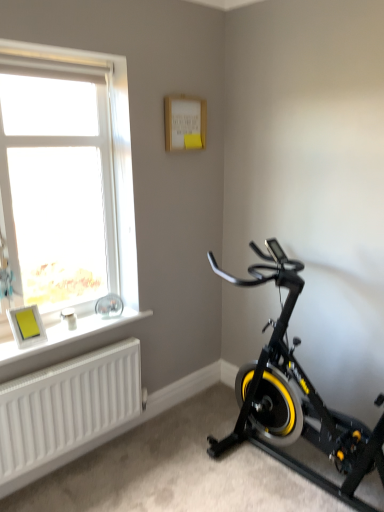
Question: From their relative heights in the image, would you say matte yellow picture frame at lower left is taller or shorter than black matte stationary bicycle at lower right?

Choices:
 (A) tall
 (B) short

Answer: (B)

Question: Is matte yellow picture frame at lower left in front of or behind black matte stationary bicycle at lower right in the image?

Choices:
 (A) behind
 (B) front

Answer: (A)

Question: Estimate the real-world distances between objects in this image. Which object is closer to the white plastic window at upper left?

Choices:
 (A) matte yellow picture frame at lower left
 (B) black matte stationary bicycle at lower right
 (C) white matte radiator at lower left
 (D) white matte window sill at lower left

Answer: (A)

Question: Which object is positioned closest to the black matte stationary bicycle at lower right?

Choices:
 (A) white plastic window at upper left
 (B) matte yellow picture frame at lower left
 (C) white matte window sill at lower left
 (D) white matte radiator at lower left

Answer: (D)